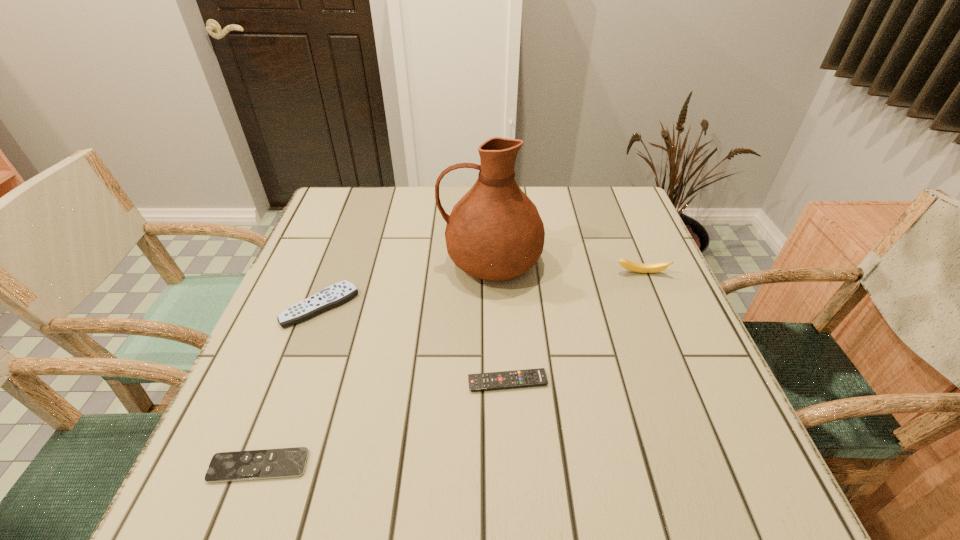
You are a GUI agent. You are given a task and a screenshot of the screen. Output one action in this format:
    pyautogui.click(x=<x>, y=<y>)
    Task: Click on the free space that satisfies the following two spatial constraints: 1. on the side of the second nearest object with the handle; 2. on the left side of the pitcher
    This screenshot has height=540, width=960.
    Given the screenshot: What is the action you would take?
    pyautogui.click(x=494, y=382)

Identify the location of vacant region that satisfies the following two spatial constraints: 1. on the side of the tallest object with the handle; 2. on the right side of the second tallest remote control. (494, 382).

Locate an element on the screen. free space that satisfies the following two spatial constraints: 1. on the back side of the second nearest object; 2. on the left side of the nearest object is located at coordinates (291, 382).